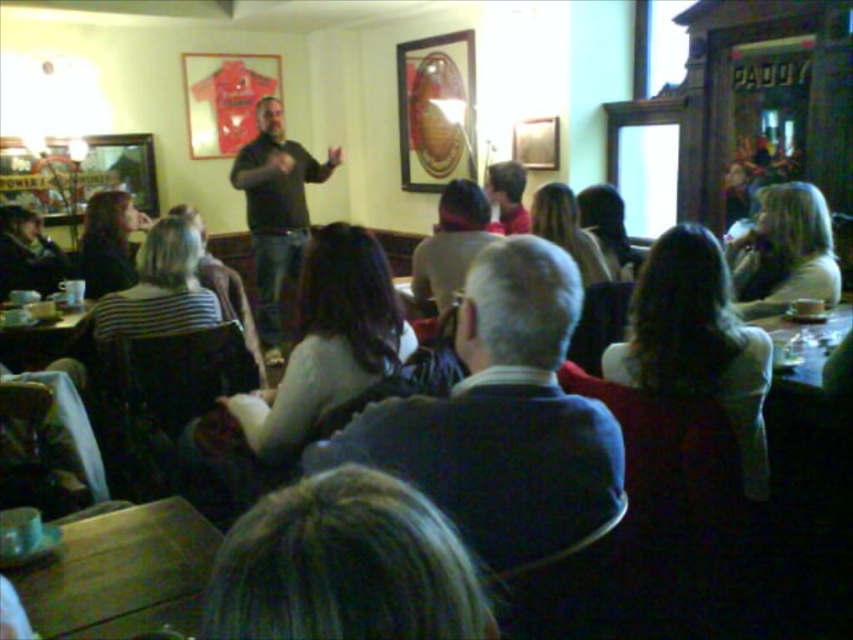
Is point (526, 548) positioned after point (808, 344)?

No, (526, 548) is in front of (808, 344).

Who is more distant from viewer, (546, 488) or (837, 339)?

Point (837, 339)

Image resolution: width=853 pixels, height=640 pixels. Identify the location of dark blue sweater at center. (502, 419).

Can you confirm if wooden table at lower left is positioned to the left of black matte shirt at center?

Incorrect, wooden table at lower left is not on the left side of black matte shirt at center.

What do you see at coordinates (120, 573) in the screenshot? This screenshot has height=640, width=853. I see `wooden table at lower left` at bounding box center [120, 573].

Does point (19, 573) come closer to viewer compared to point (260, 172)?

That is True.

Where is `wooden table at lower left`? The image size is (853, 640). wooden table at lower left is located at coordinates (120, 573).

You are a GUI agent. You are given a task and a screenshot of the screen. Output one action in this format:
    pyautogui.click(x=<x>, y=<y>)
    Task: Click on the wooden table at lower left
    The height and width of the screenshot is (640, 853).
    Given the screenshot: What is the action you would take?
    pyautogui.click(x=120, y=573)